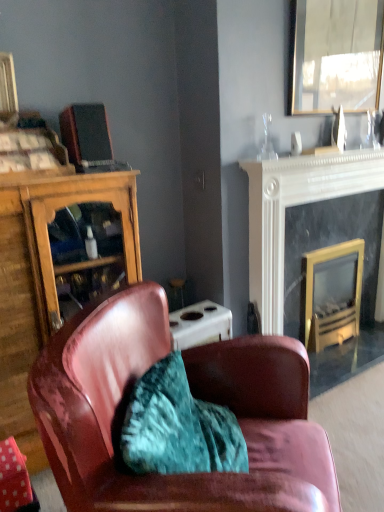
Question: Is wooden cabinet at left bigger or smaller than leather armchair at center?

Choices:
 (A) big
 (B) small

Answer: (B)

Question: Would you say wooden cabinet at left is inside or outside leather armchair at center?

Choices:
 (A) outside
 (B) inside

Answer: (A)

Question: Considering the real-world distances, which object is farthest from the leather armchair at center?

Choices:
 (A) wooden cabinet at left
 (B) black marble fireplace at upper right, placed as the 1th fireplace when sorted from right to left
 (C) metallic reflective mirror at upper right
 (D) gold-framed glass fireplace at right, marked as the 1th fireplace in a left-to-right arrangement
 (E) matte black speaker at upper left

Answer: (C)

Question: Which object is positioned closest to the metallic reflective mirror at upper right?

Choices:
 (A) black marble fireplace at upper right, placed as the 2th fireplace when sorted from left to right
 (B) gold-framed glass fireplace at right, marked as the 1th fireplace in a left-to-right arrangement
 (C) leather armchair at center
 (D) wooden cabinet at left
 (E) matte black speaker at upper left

Answer: (A)